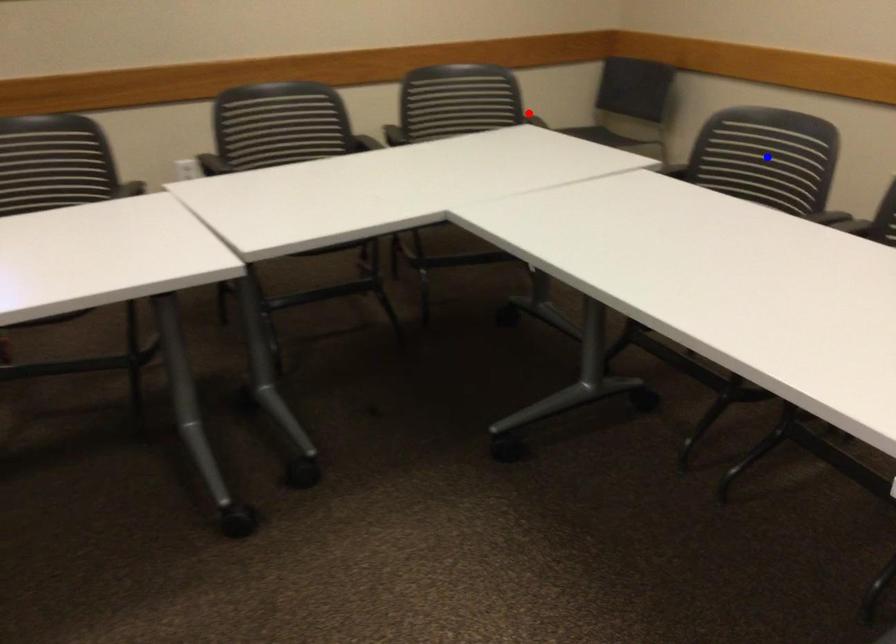
Question: Which of the two points in the image is closer to the camera?

Choices:
 (A) Blue point is closer.
 (B) Red point is closer.

Answer: (A)